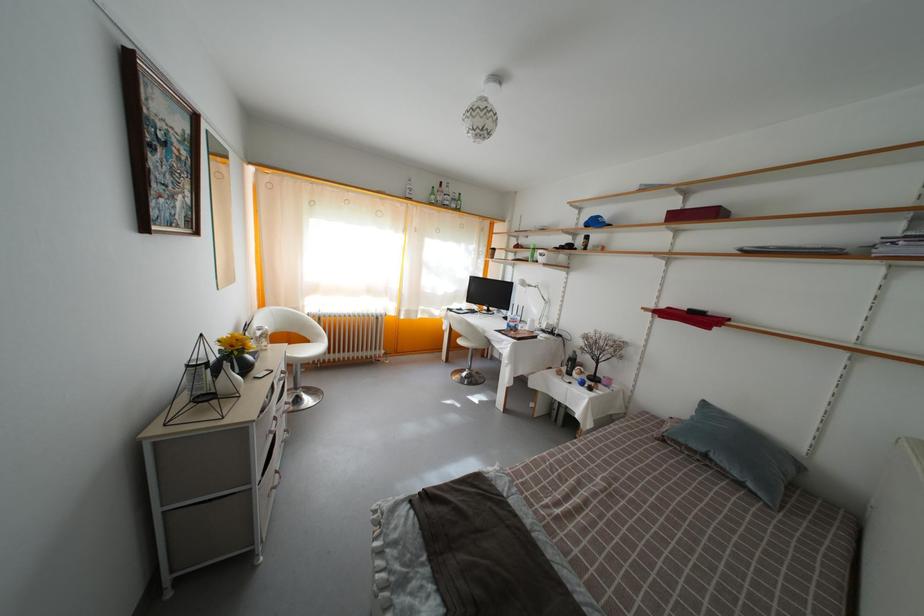
Find where to lift the clear glass bottle. Please return your answer as a coordinate pair (x, y).

(261, 337)